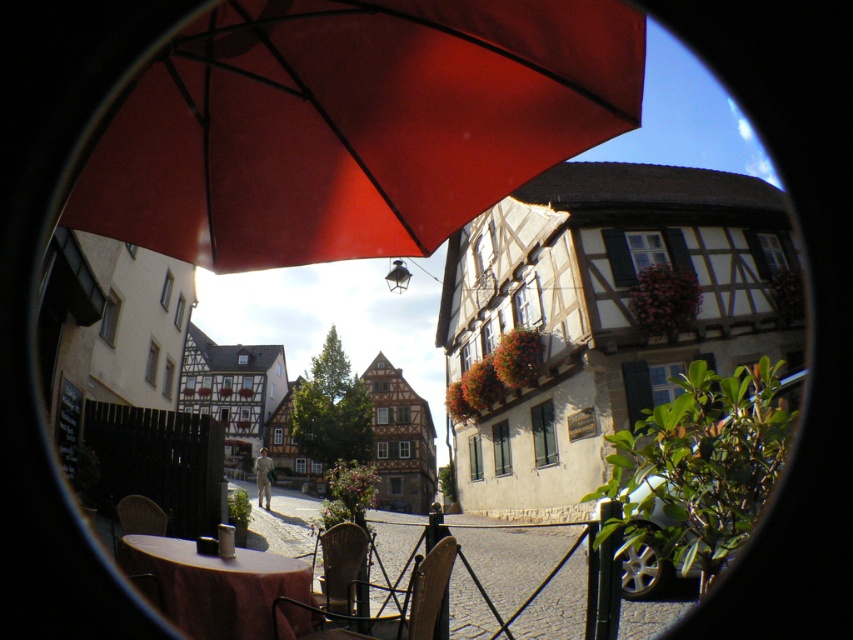
Who is positioned more to the right, matte red umbrella at upper center or rattan chair at lower left?

From the viewer's perspective, matte red umbrella at upper center appears more on the right side.

Can you confirm if matte red umbrella at upper center is positioned below rattan chair at lower left?

No.

Who is more distant from viewer, (378, 253) or (138, 497)?

The point (138, 497) is more distant.

Identify the location of matte red umbrella at upper center. (352, 124).

Which is more to the right, brown fabric table at lower left or wooden chair at lower center?

Positioned to the right is wooden chair at lower center.

Find the location of a particular element. This screenshot has height=640, width=853. brown fabric table at lower left is located at coordinates (212, 586).

Between smooth stone alley at center and rattan chair at lower left, which one is positioned higher?

rattan chair at lower left is higher up.

Which is more to the right, smooth stone alley at center or rattan chair at lower left?

From the viewer's perspective, smooth stone alley at center appears more on the right side.

Does point (463, 612) lie behind point (131, 532)?

Yes, point (463, 612) is behind point (131, 532).

Identify the location of smooth stone alley at center. The height and width of the screenshot is (640, 853). (509, 556).